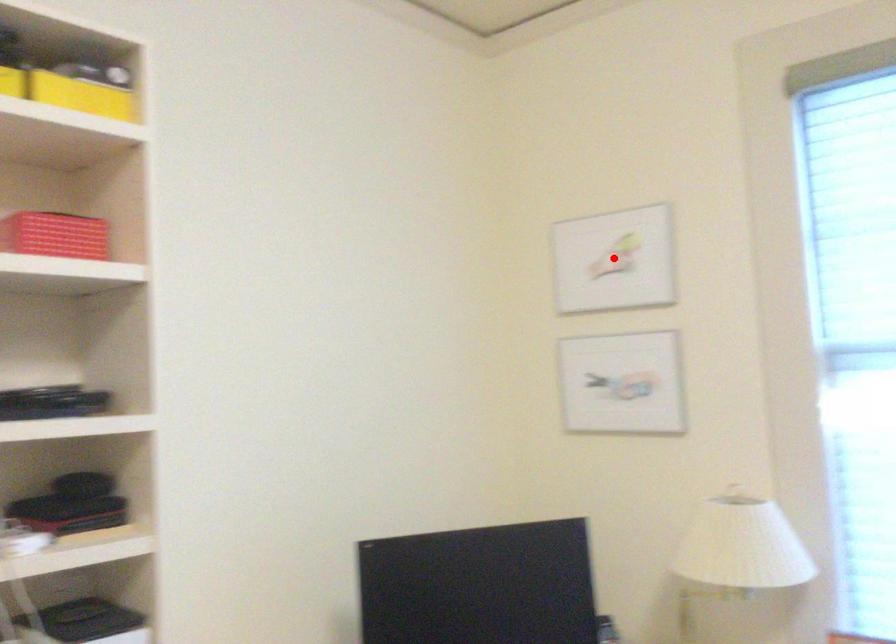
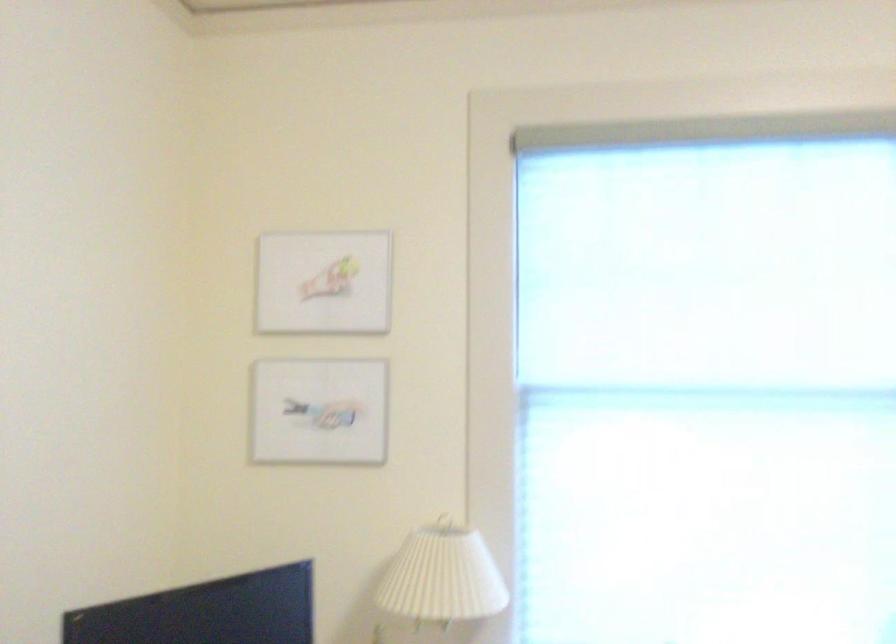
In the second image, find the point that corresponds to the highlighted location in the first image.

(323, 283)